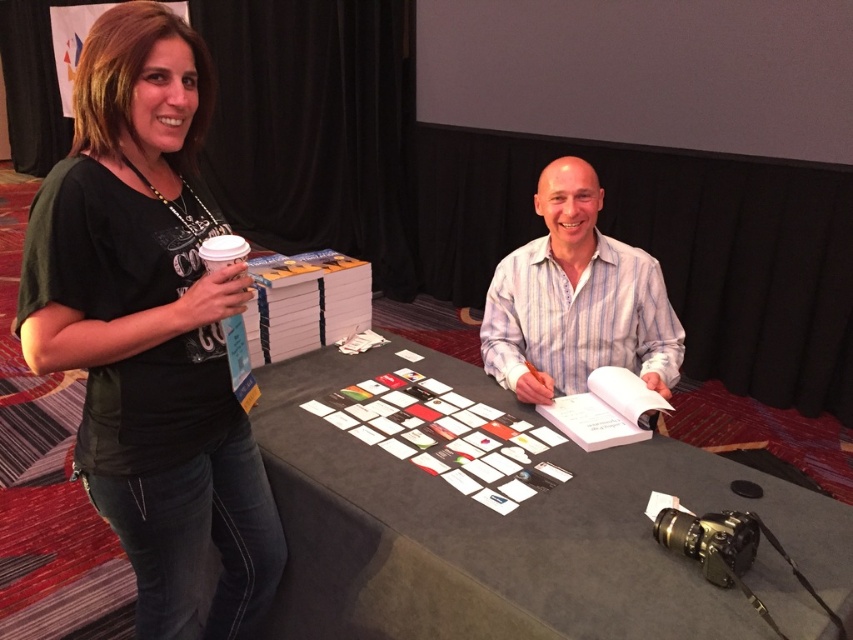
Question: Estimate the real-world distances between objects in this image. Which object is farther from the white striped shirt at center?

Choices:
 (A) black fabric table at center
 (B) black matte t-shirt at upper left

Answer: (B)

Question: Which object is positioned closest to the white striped shirt at center?

Choices:
 (A) black fabric table at center
 (B) black matte t-shirt at upper left

Answer: (A)

Question: Can you confirm if black fabric table at center is smaller than white striped shirt at center?

Choices:
 (A) yes
 (B) no

Answer: (B)

Question: Which object is farther from the camera taking this photo?

Choices:
 (A) black matte t-shirt at upper left
 (B) black fabric table at center

Answer: (A)

Question: Observing the image, what is the correct spatial positioning of black matte t-shirt at upper left in reference to black fabric table at center?

Choices:
 (A) below
 (B) above

Answer: (B)

Question: Can you confirm if black matte t-shirt at upper left is wider than black fabric table at center?

Choices:
 (A) yes
 (B) no

Answer: (B)